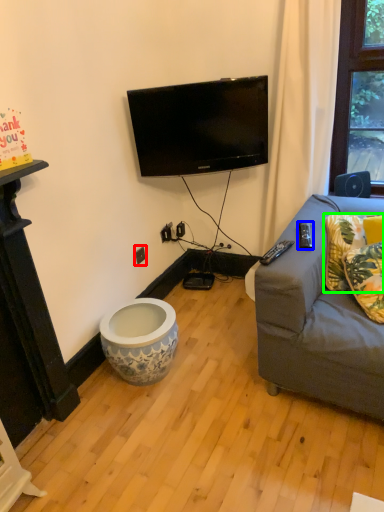
Question: Estimate the real-world distances between objects in this image. Which object is closer to electric outlet (highlighted by a red box), remote control (highlighted by a blue box) or pillow (highlighted by a green box)?

Choices:
 (A) remote control
 (B) pillow

Answer: (A)